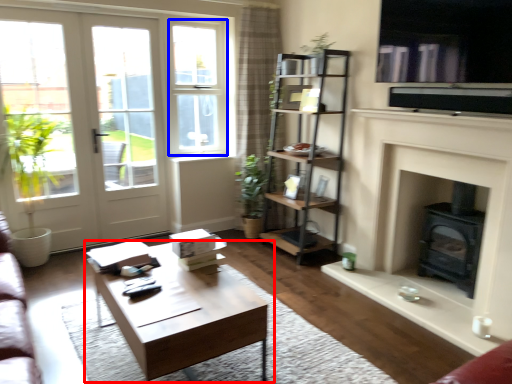
Question: Among these objects, which one is nearest to the camera, coffee table (highlighted by a red box) or window frame (highlighted by a blue box)?

Choices:
 (A) coffee table
 (B) window frame

Answer: (A)